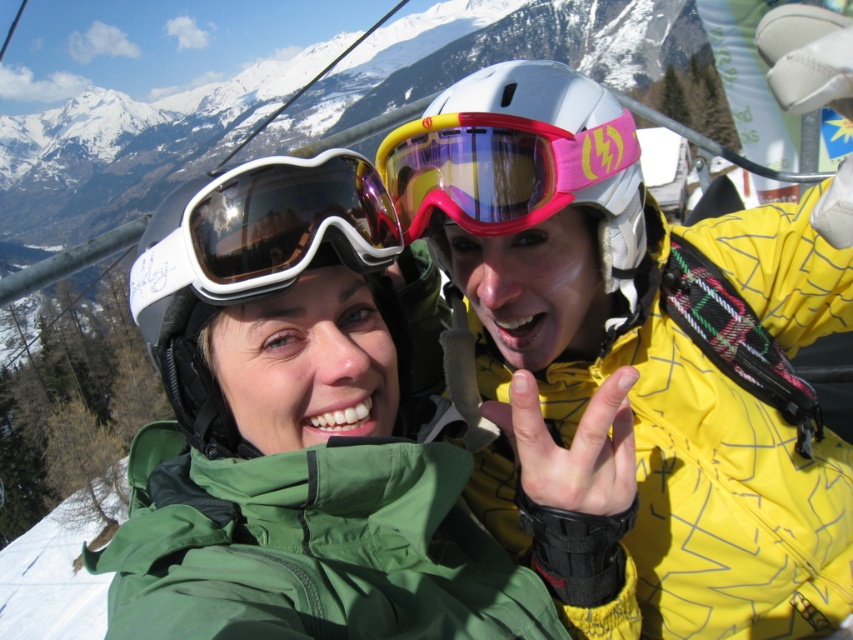
Question: Which object is closer to the camera taking this photo?

Choices:
 (A) green fabric jacket at center
 (B) white matte ski goggles at center

Answer: (A)

Question: Is green fabric jacket at center positioned behind pink matte ski goggles at center?

Choices:
 (A) no
 (B) yes

Answer: (A)

Question: Which point appears closest to the camera in this image?

Choices:
 (A) (339, 252)
 (B) (432, 115)
 (C) (451, 518)

Answer: (A)

Question: In this image, where is green fabric jacket at center located relative to white matte ski goggles at center?

Choices:
 (A) left
 (B) right

Answer: (B)

Question: Which point is closer to the camera taking this photo?

Choices:
 (A) (395, 161)
 (B) (364, 266)

Answer: (B)

Question: Can you confirm if white matte ski goggles at center is positioned to the right of pink matte ski goggles at center?

Choices:
 (A) yes
 (B) no

Answer: (B)